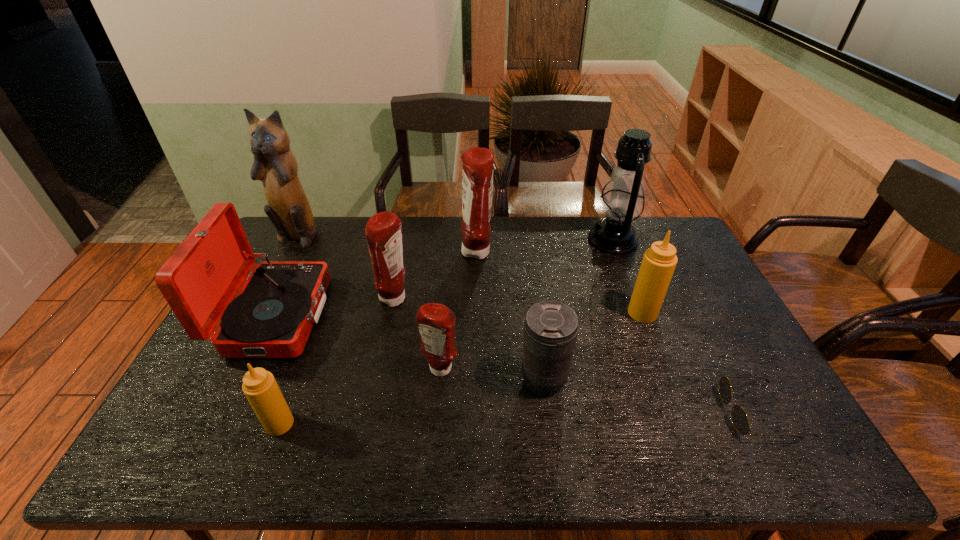
Where is `cat present at the far edge`? The image size is (960, 540). cat present at the far edge is located at coordinates (275, 165).

The image size is (960, 540). I want to click on oil lamp that is at the far edge, so click(622, 201).

Where is `condiment present at the far edge`? condiment present at the far edge is located at coordinates (477, 175).

This screenshot has height=540, width=960. I want to click on condiment that is at the near edge, so click(259, 386).

Find the location of `sunglasses located in the near edge section of the desktop`. sunglasses located in the near edge section of the desktop is located at coordinates (740, 420).

You are a GUI agent. You are given a task and a screenshot of the screen. Output one action in this format:
    pyautogui.click(x=<x>, y=<y>)
    Task: Click on the cat present at the left edge
    The image size is (960, 540).
    Given the screenshot: What is the action you would take?
    pyautogui.click(x=275, y=165)

Locate an element on the screen. The width and height of the screenshot is (960, 540). phonograph_record located at the left edge is located at coordinates (272, 316).

This screenshot has width=960, height=540. In order to click on object present at the right edge in this screenshot , I will do `click(740, 420)`.

Locate an element on the screen. This screenshot has width=960, height=540. object at the far left corner is located at coordinates (x=275, y=165).

Locate an element on the screen. object that is at the near right corner is located at coordinates (740, 420).